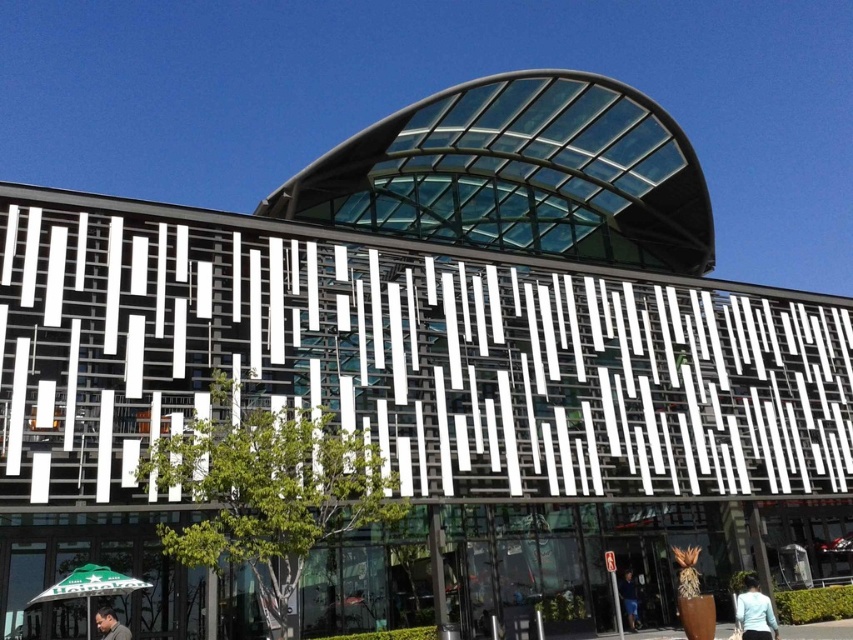
You are a visitor standing in front of the modern building. You notice a green fabric umbrella at lower left and a light blue fabric at lower right. Which object is positioned higher from the ground?

The green fabric umbrella at lower left is located above the light blue fabric at lower right, so it is positioned higher from the ground.

You are standing at the entrance of the modern building and see the light blue fabric at lower right and the dark brown leather jacket at lower left. You need to walk from the entrance to the closest object. Which one should you walk towards?

The dark brown leather jacket at lower left is closer to you than the light blue fabric at lower right, so you should walk towards the dark brown leather jacket at lower left.